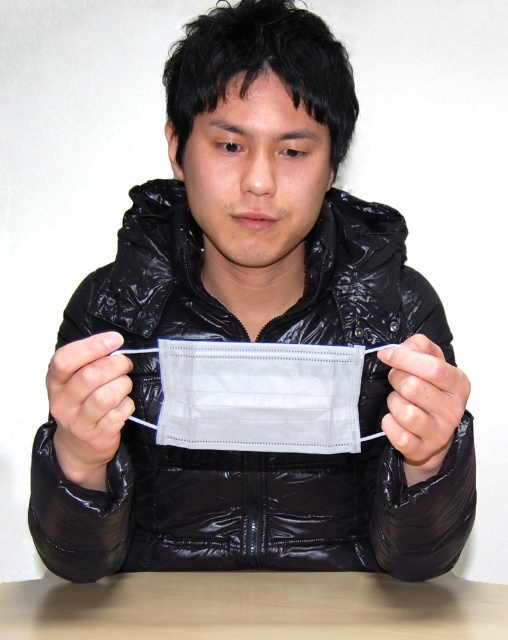
Looking at this image, you are a photographer setting up a photoshoot. You need to place a reflective surface on the table to enhance the jacket. However, the table is already occupied by the jacket. Can you place the reflective surface on the light brown wooden table at lower center without moving the black shiny jacket at center?

The black shiny jacket at center is positioned over light brown wooden table at lower center, so the reflective surface cannot be placed there without moving the jacket.

You are a photographer setting up a shoot. You have a black shiny jacket at center and a white matte mask at center in front of you. Which object should you adjust first if you want to ensure both items are framed equally in your composition?

The black shiny jacket at center is larger in size than the white matte mask at center, so you should adjust the position of the black shiny jacket at center to make it smaller or move it further away to balance the composition.

You are a photographer trying to capture a clear shot of the white matte fabric mask at center. However, the black shiny jacket at center is blocking your view. Can you determine if moving the camera slightly forward would allow you to see the mask without obstruction?

The white matte fabric mask at center is behind the black shiny jacket at center, so moving the camera slightly forward might not help as the jacket is still blocking the mask. You might need to adjust the angle sideways instead.